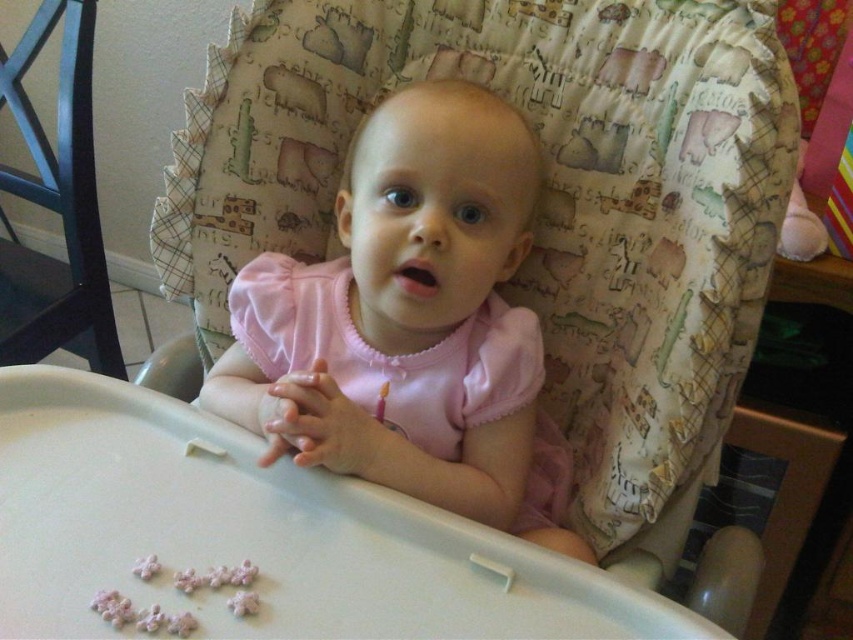
Is pink matte dress at center positioned in front of black plastic feeding chair at left?

That is True.

Does pink matte dress at center come behind black plastic feeding chair at left?

No, it is in front of black plastic feeding chair at left.

Is point (486, 490) positioned behind point (0, 264)?

No.

Identify the location of pink matte dress at center. This screenshot has width=853, height=640. 412,323.

Can you confirm if pink matte dress at center is thinner than pink sugar flowers at lower center?

No, pink matte dress at center is not thinner than pink sugar flowers at lower center.

Is pink matte dress at center bigger than pink sugar flowers at lower center?

Yes, pink matte dress at center is bigger than pink sugar flowers at lower center.

Is point (279, 256) closer to camera compared to point (219, 579)?

That is False.

This screenshot has height=640, width=853. I want to click on pink matte dress at center, so point(412,323).

How far apart are black plastic feeding chair at left and pink sugar flowers at lower center?

black plastic feeding chair at left and pink sugar flowers at lower center are 38.02 inches apart.

Between black plastic feeding chair at left and pink sugar flowers at lower center, which one is positioned higher?

Positioned higher is black plastic feeding chair at left.

What do you see at coordinates (56, 208) in the screenshot?
I see `black plastic feeding chair at left` at bounding box center [56, 208].

This screenshot has width=853, height=640. Find the location of `black plastic feeding chair at left`. black plastic feeding chair at left is located at coordinates (56, 208).